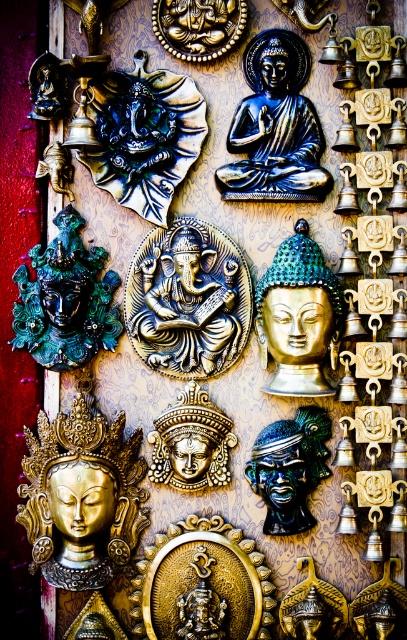
You are an art curator arranging a display of two Ganesha sculptures. The gold metallic ganesh at center and the green patina metal ganesh at upper center. Which one is placed higher in the image?

The green patina metal ganesh at upper center is placed higher in the image than the gold metallic ganesh at center.

You are an art curator examining two points in the image of the artisanal shop. The first point is at coordinates point (x=166, y=280) and the second is at point (x=164, y=106). Which of these two points is nearer to you?

Point (x=166, y=280) is closer to the viewer than point (x=164, y=106).